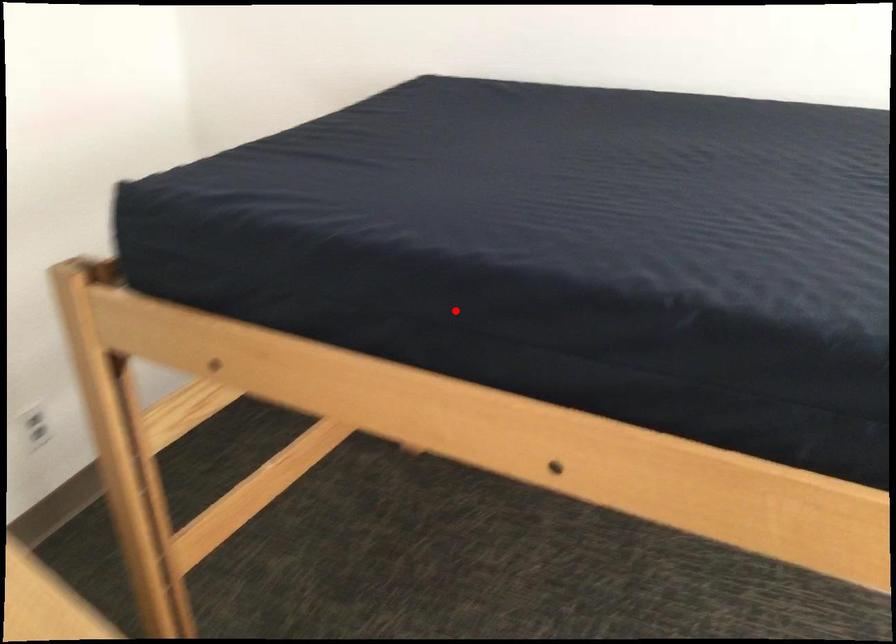
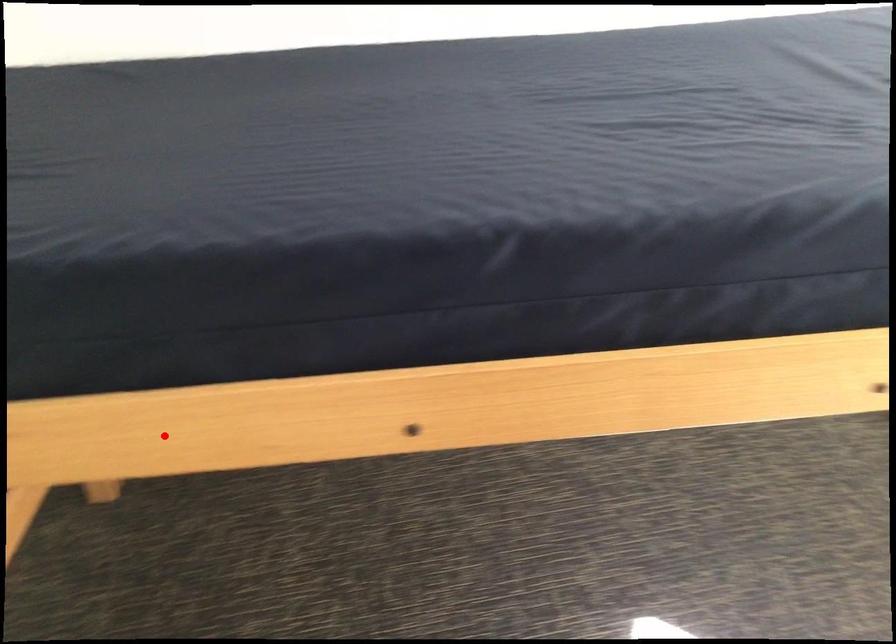
I am providing you with two images of the same scene from different viewpoints. A red point is marked on the first image and another point is marked on the second image. Does the point marked in image1 correspond to the same location as the one in image2?

No